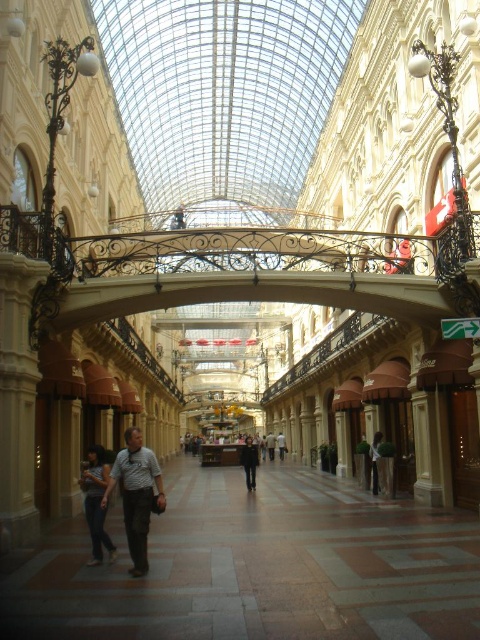
Question: Is black fabric jacket at center thinner than white cotton shirt at center?

Choices:
 (A) no
 (B) yes

Answer: (A)

Question: Which object is positioned closest to the striped cotton shirt at center?

Choices:
 (A) denim pants at lower left
 (B) white cotton shirt at center
 (C) dark gray shirt at center
 (D) black fabric jacket at center

Answer: (A)

Question: Does black fabric jacket at center have a larger size compared to white cotton shirt at center?

Choices:
 (A) yes
 (B) no

Answer: (A)

Question: Which point appears closest to the camera in this image?

Choices:
 (A) (137, 548)
 (B) (376, 476)
 (C) (100, 522)
 (D) (268, 445)

Answer: (A)

Question: Among these points, which one is nearest to the camera?

Choices:
 (A) (141, 436)
 (B) (377, 488)
 (C) (93, 506)
 (D) (253, 480)

Answer: (C)

Question: Considering the relative positions of white cotton shirt at center and dark gray shirt at center in the image provided, where is white cotton shirt at center located with respect to dark gray shirt at center?

Choices:
 (A) left
 (B) right

Answer: (B)